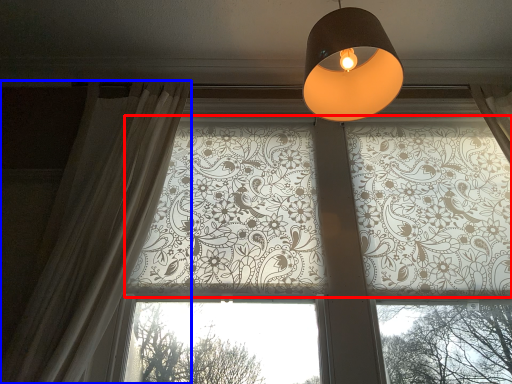
Question: Which of the following is the farthest to the observer, bay window (highlighted by a red box) or curtain (highlighted by a blue box)?

Choices:
 (A) bay window
 (B) curtain

Answer: (A)